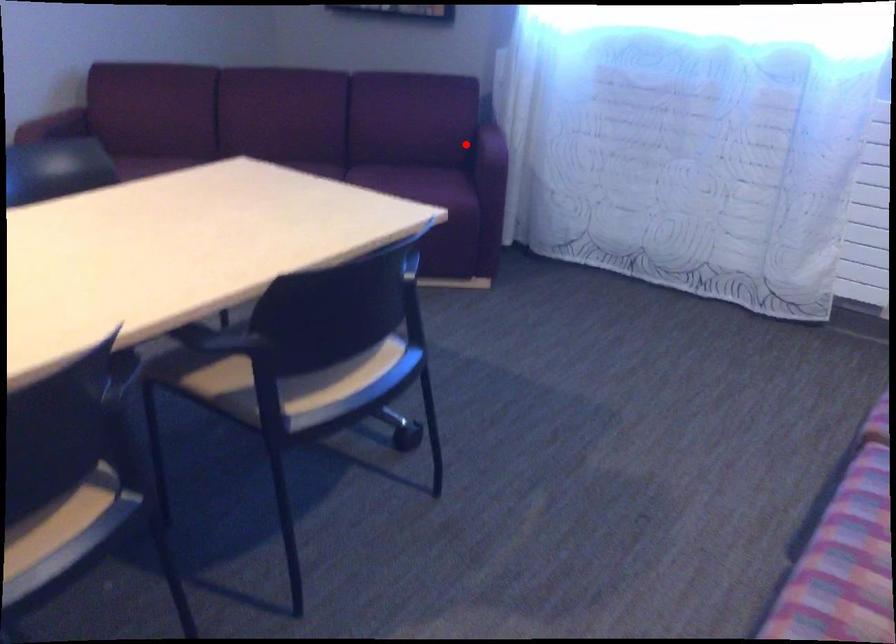
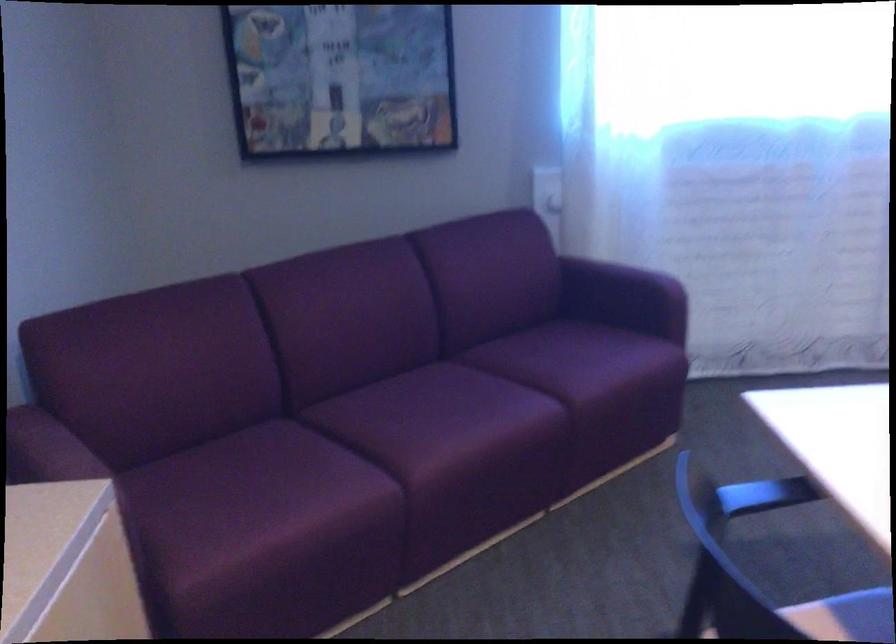
Where in the second image is the point corresponding to the highlighted location from the first image?

(617, 289)